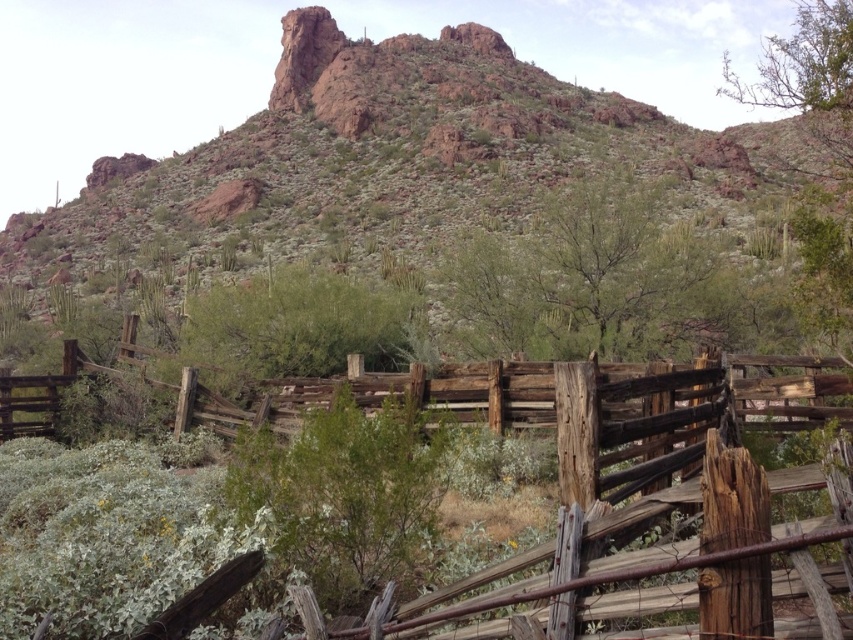
The image size is (853, 640). I want to click on rusty rock formation at upper center, so click(x=479, y=198).

Describe the element at coordinates (479, 198) in the screenshot. I see `rusty rock formation at upper center` at that location.

Find the location of `rusty rock formation at upper center`. rusty rock formation at upper center is located at coordinates (479, 198).

This screenshot has height=640, width=853. I want to click on rusty rock formation at upper center, so click(x=479, y=198).